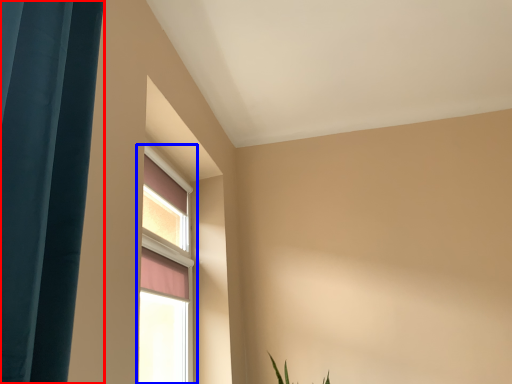
Question: Which of the following is the farthest to the observer, curtain (highlighted by a red box) or window (highlighted by a blue box)?

Choices:
 (A) curtain
 (B) window

Answer: (B)